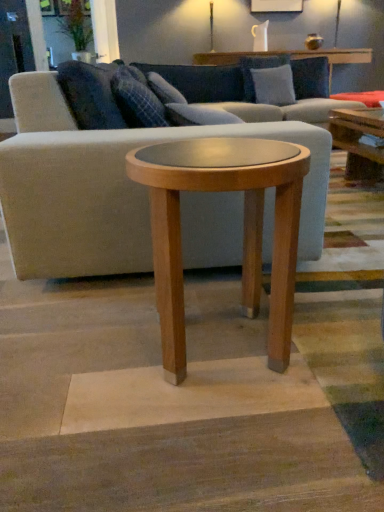
You are a GUI agent. You are given a task and a screenshot of the screen. Output one action in this format:
    pyautogui.click(x=<x>, y=<y>)
    Task: Click on the vacant area that is situated to the right of light brown wood side table at center
    The height and width of the screenshot is (512, 384).
    Given the screenshot: What is the action you would take?
    pyautogui.click(x=337, y=329)